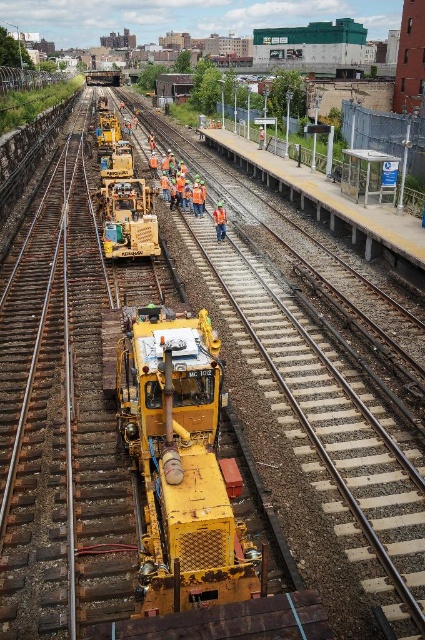
Question: Considering the relative positions of yellow rubber construction vehicle at center and orange reflective safety vest at center in the image provided, where is yellow rubber construction vehicle at center located with respect to orange reflective safety vest at center?

Choices:
 (A) above
 (B) below

Answer: (A)

Question: Which point is closer to the camera?

Choices:
 (A) matte yellow construction vehicle at center
 (B) orange reflective safety vest at center

Answer: (A)

Question: Which point is farther from the camera taking this photo?

Choices:
 (A) (169, 522)
 (B) (221, 202)

Answer: (B)

Question: Is yellow rubber construction vehicle at center further to camera compared to orange reflective safety vest at center?

Choices:
 (A) yes
 (B) no

Answer: (B)

Question: Estimate the real-world distances between objects in this image. Which object is closer to the matte yellow construction vehicle at center?

Choices:
 (A) yellow rubber construction vehicle at center
 (B) orange reflective safety vest at center

Answer: (B)

Question: Is yellow rubber construction vehicle at center behind orange reflective safety vest at center?

Choices:
 (A) yes
 (B) no

Answer: (B)